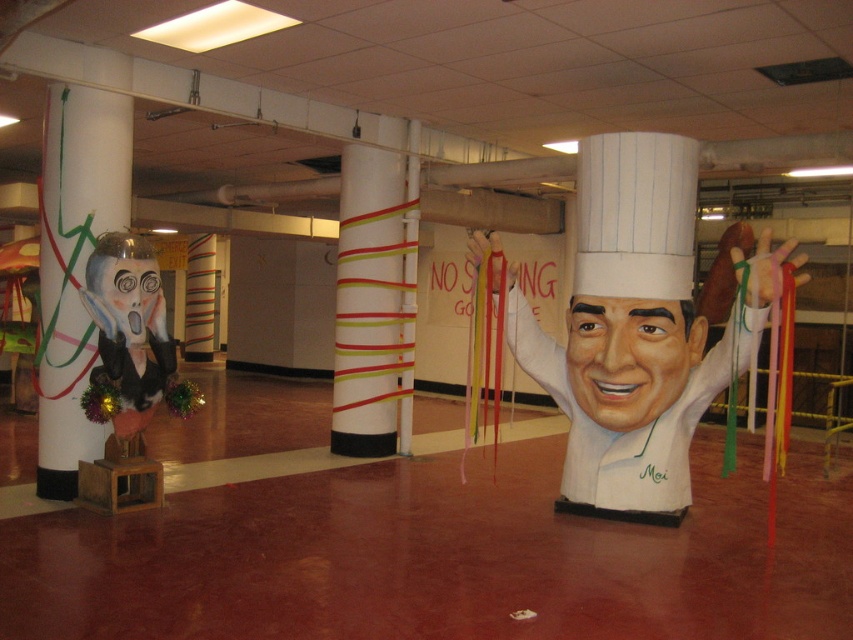
Does smooth white chef hat at center come in front of matte black face at left?

That is True.

Does smooth white chef hat at center appear under matte black face at left?

Yes.

Where is `smooth white chef hat at center`? The image size is (853, 640). smooth white chef hat at center is located at coordinates (630, 356).

Can you confirm if white striped column at center is wider than matte black face at left?

Correct, the width of white striped column at center exceeds that of matte black face at left.

Is point (347, 396) behind point (102, 262)?

Yes, point (347, 396) is farther from viewer.

Where is `white striped column at center`? This screenshot has width=853, height=640. white striped column at center is located at coordinates (368, 301).

Who is more distant from viewer, (643, 220) or (102, 280)?

Point (102, 280)

Does white paper chef hat at center come behind matte black face at left?

That is False.

Is point (560, 365) closer to camera compared to point (131, 292)?

No, (560, 365) is further to viewer.

The image size is (853, 640). In order to click on white paper chef hat at center in this screenshot , I will do click(640, 326).